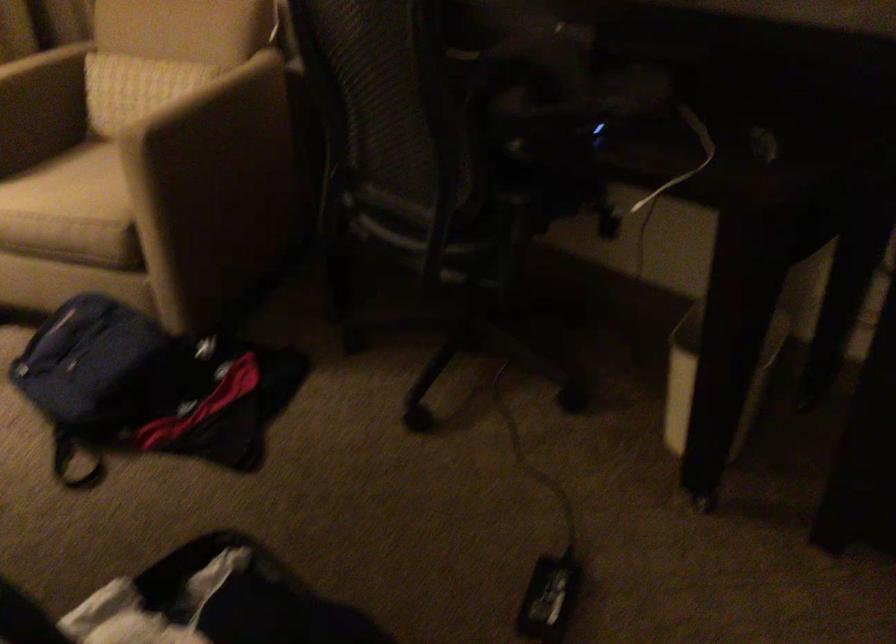
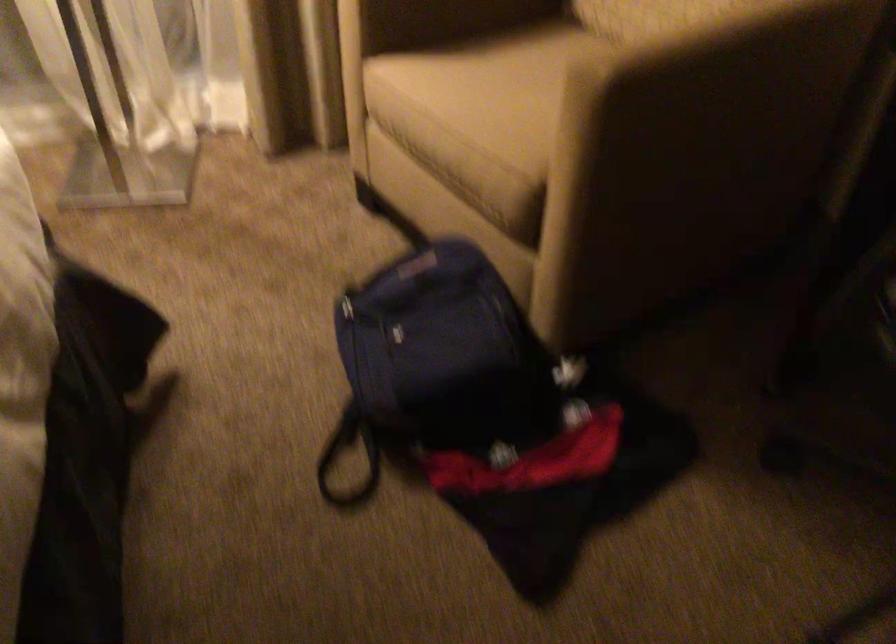
Find the pixel in the second image that matches pixel 115 366 in the first image.

(442, 366)